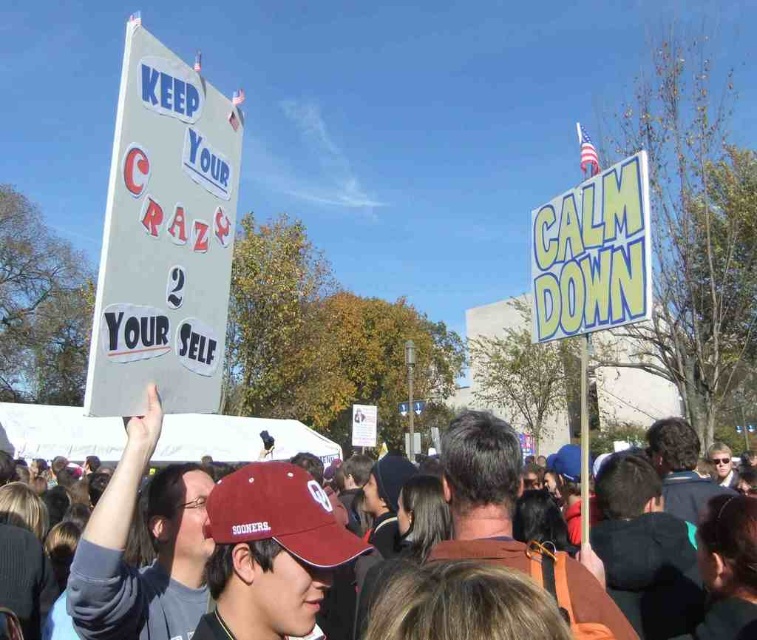
Between brown leather jacket at center and yellowmaterial/texturesign at upper right, which one is positioned higher?

yellowmaterial/texturesign at upper right is higher up.

Which is in front, point (25, 406) or point (611, 177)?

Positioned in front is point (611, 177).

Where is `brown leather jacket at center`? The image size is (757, 640). brown leather jacket at center is located at coordinates (55, 433).

Does white cardboard sign at upper left come in front of brown leather jacket at center?

Yes, it is in front of brown leather jacket at center.

Can you confirm if white cardboard sign at upper left is taller than brown leather jacket at center?

No.

Is point (212, 124) more distant than point (231, 442)?

No, it is not.

The height and width of the screenshot is (640, 757). Find the location of `white cardboard sign at upper left`. white cardboard sign at upper left is located at coordinates (164, 237).

Can you confirm if white cardboard sign at upper left is taller than yellowmaterial/texturesign at upper right?

Indeed, white cardboard sign at upper left has a greater height compared to yellowmaterial/texturesign at upper right.

Is point (136, 97) in front of point (578, 236)?

Yes.

Between point (209, 211) and point (634, 177), which one is positioned behind?

The point (209, 211) is behind.

The width and height of the screenshot is (757, 640). In order to click on white cardboard sign at upper left in this screenshot , I will do `click(164, 237)`.